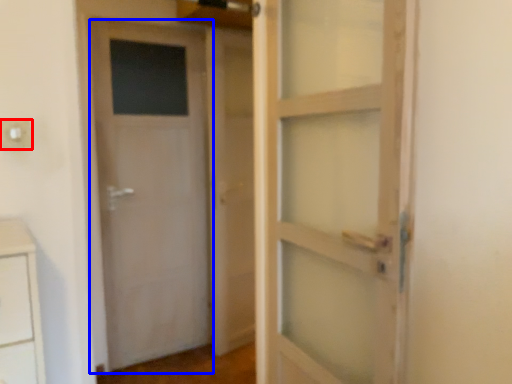
Question: Which object appears closest to the camera in this image, electric outlet (highlighted by a red box) or door (highlighted by a blue box)?

Choices:
 (A) electric outlet
 (B) door

Answer: (A)